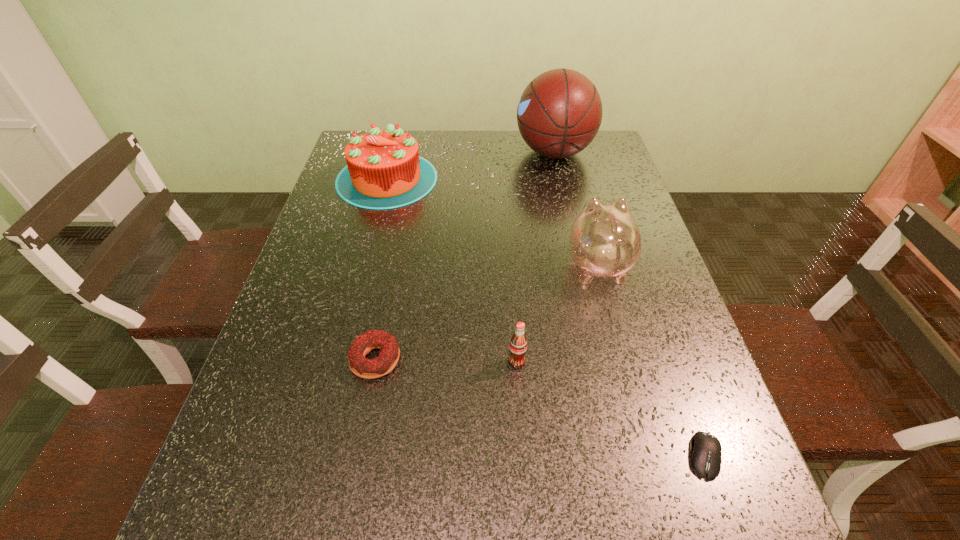
Locate an element on the screen. The image size is (960, 540). the tallest object is located at coordinates (559, 113).

Locate an element on the screen. The image size is (960, 540). cake is located at coordinates (384, 170).

I want to click on the third farthest object, so click(605, 240).

Where is `the third shortest object`? This screenshot has width=960, height=540. the third shortest object is located at coordinates (518, 343).

What are the coordinates of `soda` in the screenshot? It's located at (518, 343).

Identify the location of the fifth tallest object. (375, 339).

Where is `the nearest object`? the nearest object is located at coordinates (706, 454).

Where is `the shortest object`? Image resolution: width=960 pixels, height=540 pixels. the shortest object is located at coordinates (706, 454).

At what (x,y) coordinates should I click in order to perform the action: click on free space located on the left of the tallest object. Please return your answer as a coordinate pair (x, y). The width and height of the screenshot is (960, 540). Looking at the image, I should click on (492, 152).

The height and width of the screenshot is (540, 960). I want to click on free space located 0.290m on the front of the cake, so click(358, 288).